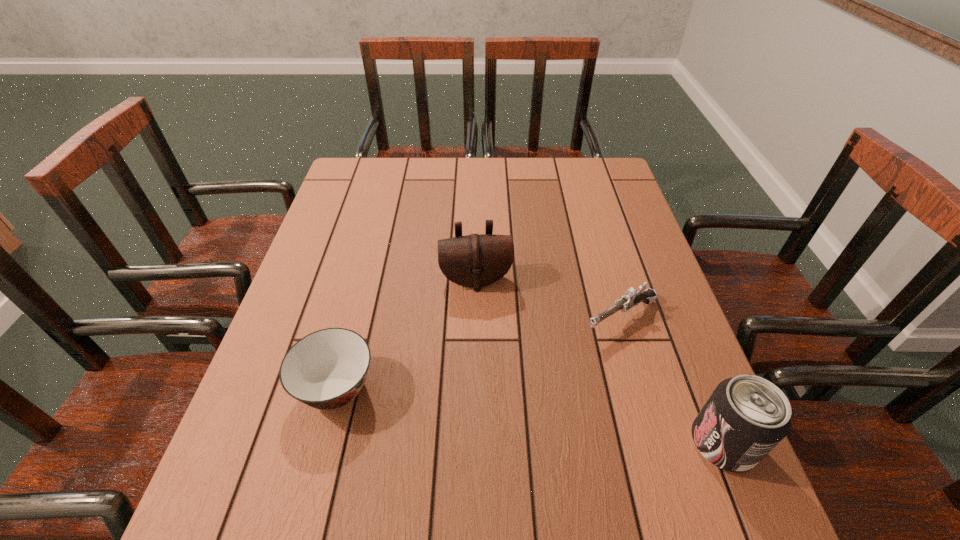
You are a GUI agent. You are given a task and a screenshot of the screen. Output one action in this format:
    pyautogui.click(x=<x>, y=<y>)
    Task: Click on the blank space that satisfies the following two spatial constraints: 1. on the back side of the leftmost object; 2. on the left side of the third object from right to left
    This screenshot has width=960, height=540.
    Given the screenshot: What is the action you would take?
    point(365,280)

Where is `vacant area that satisfies the following two spatial constraints: 1. on the front side of the soda can; 2. on the right side of the soup bowl`? The image size is (960, 540). vacant area that satisfies the following two spatial constraints: 1. on the front side of the soda can; 2. on the right side of the soup bowl is located at coordinates (323, 443).

Where is `free spot that satisfies the following two spatial constraints: 1. on the back side of the soup bowl; 2. on the left side of the gun`? The height and width of the screenshot is (540, 960). free spot that satisfies the following two spatial constraints: 1. on the back side of the soup bowl; 2. on the left side of the gun is located at coordinates (355, 318).